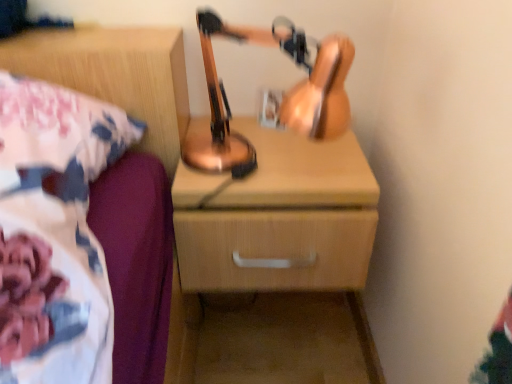
Question: From the image's perspective, is wooden chest of drawers at center located above or below copper metallic table lamp at center?

Choices:
 (A) below
 (B) above

Answer: (A)

Question: From their relative heights in the image, would you say wooden chest of drawers at center is taller or shorter than copper metallic table lamp at center?

Choices:
 (A) tall
 (B) short

Answer: (B)

Question: Estimate the real-world distances between objects in this image. Which object is closer to the wooden chest of drawers at center?

Choices:
 (A) copper metallic table lamp at center
 (B) wooden nightstand at upper right

Answer: (A)

Question: Which object is the farthest from the wooden nightstand at upper right?

Choices:
 (A) wooden chest of drawers at center
 (B) copper metallic table lamp at center

Answer: (A)